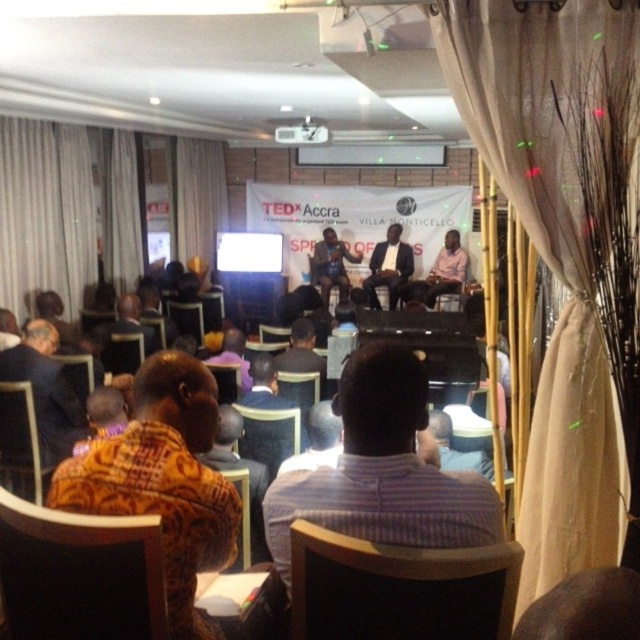
You are attending the TEDx event at Villa Monticello and notice a speaker wearing a satin black suit at center. Where exactly is this speaker positioned in the room relative to the stage?

The satin black suit at center is located at point 0.419 on the x and 0.608 on the y coordinates, meaning it is positioned slightly to the right and forward on the stage.

You are an attendee at the TEDx event and want to find a seat. You notice a printed fabric shirt at left near the point marked at [163,480]. Is there an empty seat available near that location?

The printed fabric shirt at left is located at point [163,480], which indicates that there is an occupied seat near that location. Therefore, there is no empty seat available there.